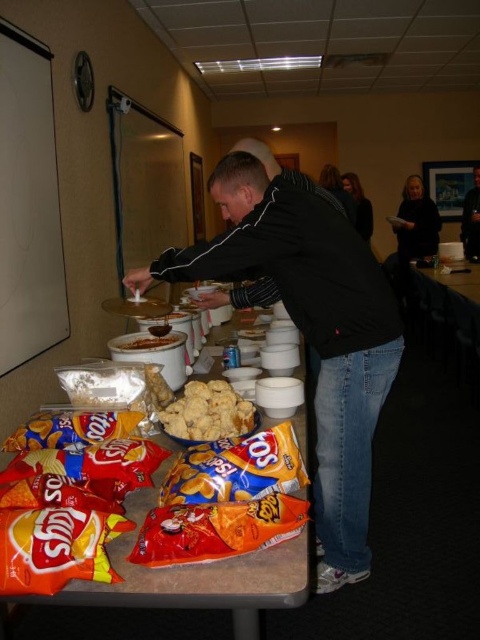
Question: Does matte plastic table at center have a greater width compared to matte orange chips at center?

Choices:
 (A) yes
 (B) no

Answer: (A)

Question: Does dark blue jeans at center come in front of matte brown cookies at center?

Choices:
 (A) no
 (B) yes

Answer: (A)

Question: Which is farther from the matte plastic table at center?

Choices:
 (A) black matte jacket at center
 (B) black matte jacket at upper center
 (C) dark blue jeans at center
 (D) smooth black shirt at upper right

Answer: (C)

Question: Which point is farther to the camera?

Choices:
 (A) (361, 422)
 (B) (302, 573)
 (C) (203, 404)
 (D) (240, 476)

Answer: (A)

Question: Which object appears farthest from the camera in this image?

Choices:
 (A) matte plastic table at center
 (B) smooth black shirt at upper right

Answer: (B)

Question: Is smooth black shirt at upper right positioned in front of black matte jacket at upper center?

Choices:
 (A) no
 (B) yes

Answer: (A)